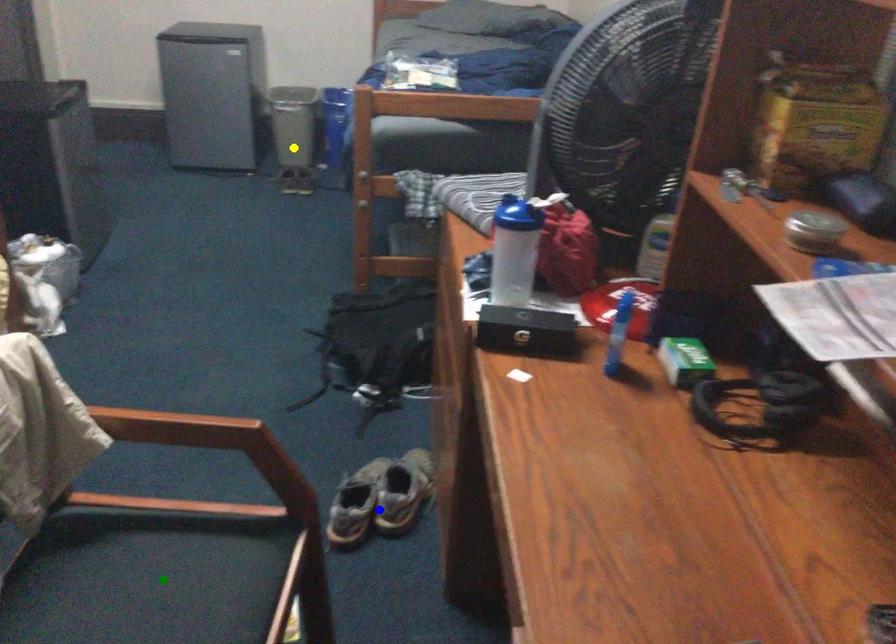
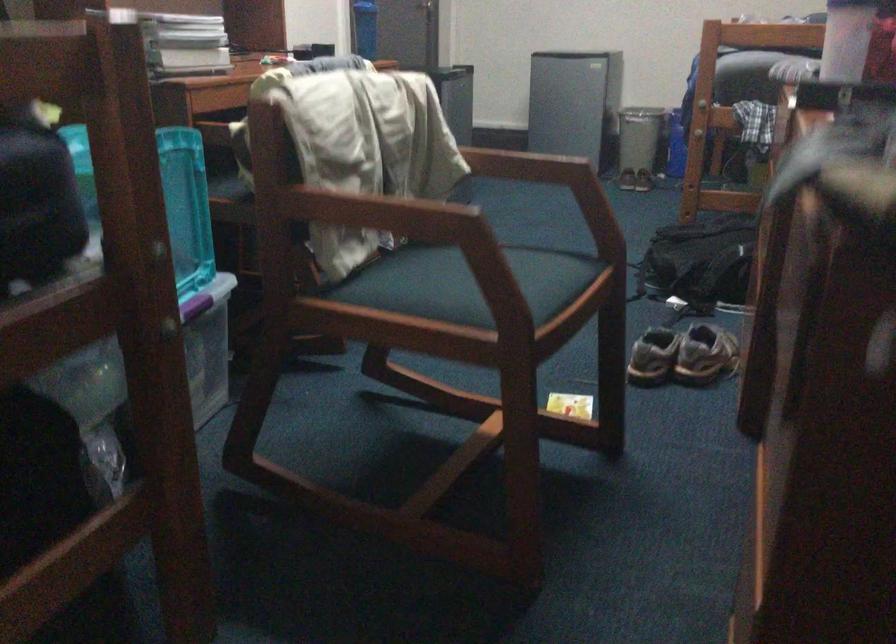
I am providing you with two images of the same scene from different viewpoints. Three points are marked in image1. Which point corresponds to a part or object that is occluded in image2?In image1, three points are marked. Which of them correspond to a part or object that is occluded in image2?Among the three points shown in image1, which one corresponds to a part or object that is no longer visible due to occlusion in image2?

green point cannot be seen in image2.